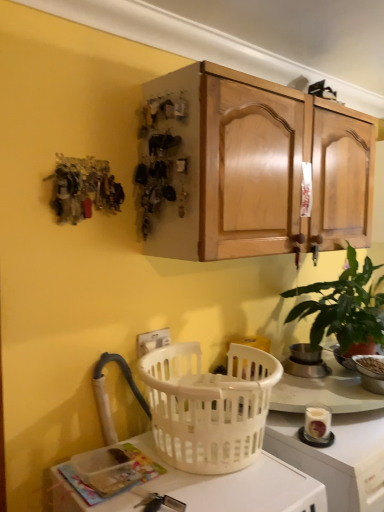
Question: From a real-world perspective, does green matte plant at right sit lower than metallic silver pot at upper right, positioned as the first appliance in left-to-right order?

Choices:
 (A) no
 (B) yes

Answer: (A)

Question: From the image's perspective, would you say green matte plant at right is positioned over metallic silver pot at upper right, positioned as the first appliance in left-to-right order?

Choices:
 (A) yes
 (B) no

Answer: (A)

Question: Does green matte plant at right contain metallic silver pot at upper right, positioned as the first appliance in left-to-right order?

Choices:
 (A) yes
 (B) no

Answer: (A)

Question: Is green matte plant at right completely or partially outside of metallic silver pot at upper right, which appears as the second appliance when viewed from the right?

Choices:
 (A) no
 (B) yes

Answer: (B)

Question: Does green matte plant at right have a lesser height compared to metallic silver pot at upper right, which appears as the second appliance when viewed from the right?

Choices:
 (A) no
 (B) yes

Answer: (A)

Question: In terms of height, does white plastic bowl at lower right, positioned as the 1th appliance in right-to-left order, look taller or shorter compared to green matte plant at right?

Choices:
 (A) short
 (B) tall

Answer: (A)

Question: Is white plastic bowl at lower right, the second appliance positioned from the left, bigger or smaller than green matte plant at right?

Choices:
 (A) small
 (B) big

Answer: (A)

Question: Considering the positions of point (354, 357) and point (357, 296), is point (354, 357) closer or farther from the camera than point (357, 296)?

Choices:
 (A) farther
 (B) closer

Answer: (B)

Question: From a real-world perspective, is white plastic bowl at lower right, positioned as the 1th appliance in right-to-left order, above or below green matte plant at right?

Choices:
 (A) above
 (B) below

Answer: (B)

Question: In the image, is green matte plant at right positioned in front of or behind white plastic electric outlet at lower center?

Choices:
 (A) front
 (B) behind

Answer: (A)

Question: Considering the positions of green matte plant at right and white plastic electric outlet at lower center in the image, is green matte plant at right taller or shorter than white plastic electric outlet at lower center?

Choices:
 (A) tall
 (B) short

Answer: (A)

Question: From the image's perspective, relative to white plastic electric outlet at lower center, is green matte plant at right above or below?

Choices:
 (A) below
 (B) above

Answer: (B)

Question: Visually, is green matte plant at right positioned to the left or to the right of white plastic electric outlet at lower center?

Choices:
 (A) left
 (B) right

Answer: (B)

Question: Based on their sizes in the image, would you say white plastic picnic basket at lower center is bigger or smaller than white plastic bowl at lower right, the second appliance positioned from the left?

Choices:
 (A) big
 (B) small

Answer: (A)

Question: Is point (177, 452) positioned closer to the camera than point (354, 359)?

Choices:
 (A) farther
 (B) closer

Answer: (B)